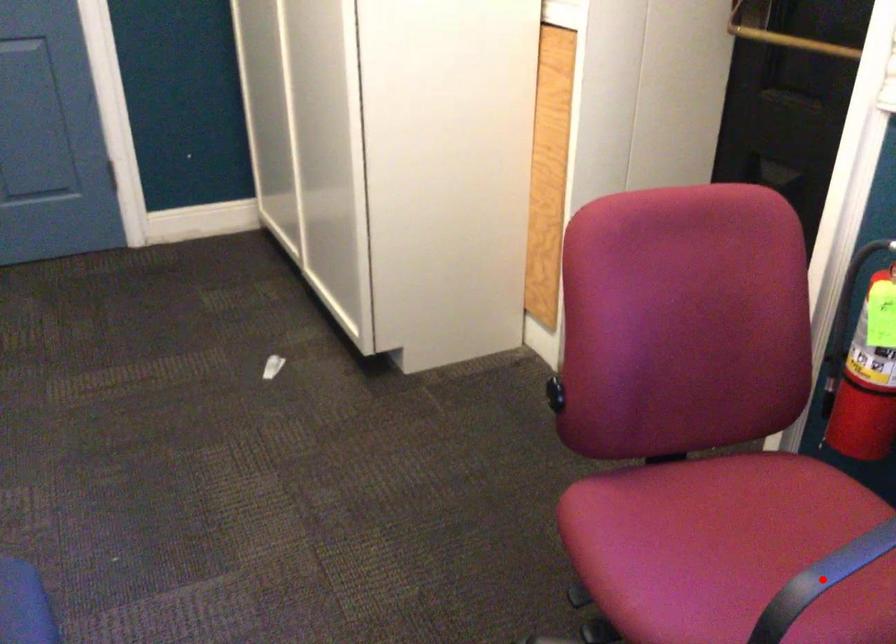
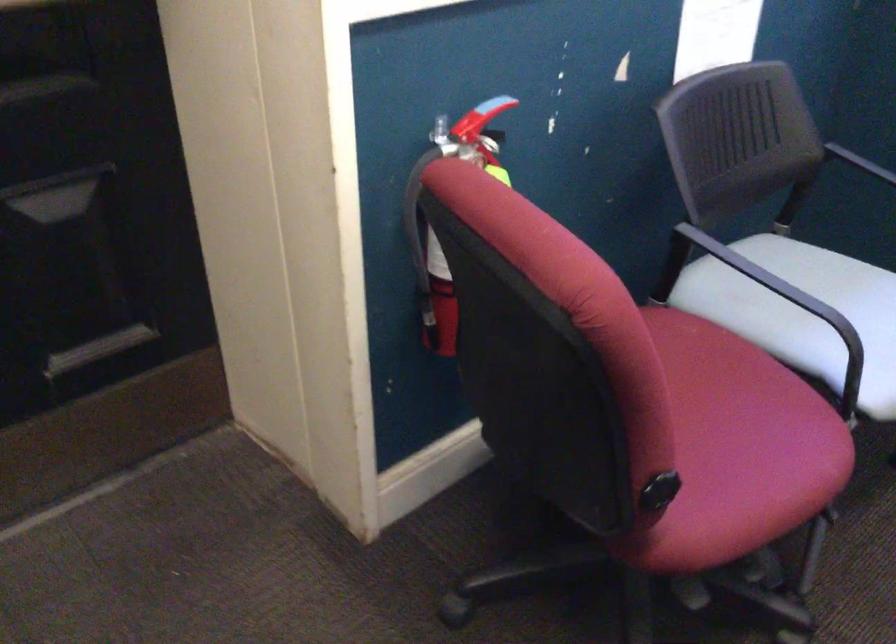
Question: I am providing you with two images of the same scene from different viewpoints. A red point is marked on the first image. Is the red point's position out of view in image 2?

Choices:
 (A) Yes
 (B) No

Answer: (A)